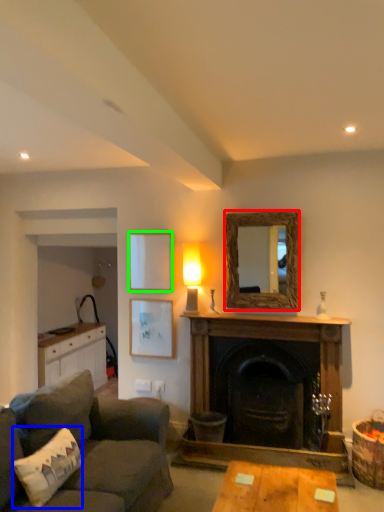
Question: Which object is the farthest from mirror (highlighted by a red box)? Choose among these: pillow (highlighted by a blue box) or picture frame (highlighted by a green box).

Choices:
 (A) pillow
 (B) picture frame

Answer: (A)